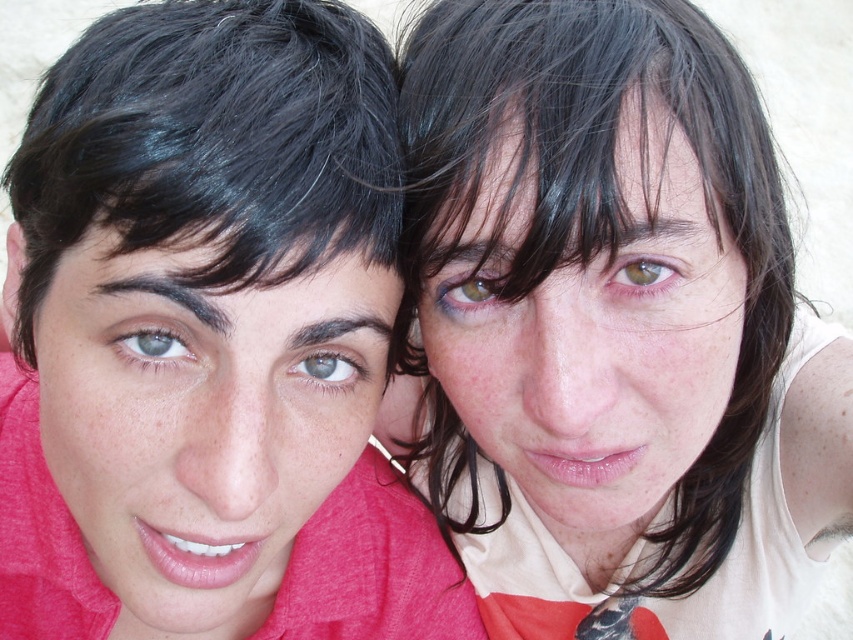
Question: Can you confirm if matte pink shirt at left is bigger than black shiny hair at left?

Choices:
 (A) yes
 (B) no

Answer: (A)

Question: Estimate the real-world distances between objects in this image. Which object is farther from the gray matte eye at center?

Choices:
 (A) dry matte skin at center
 (B) brown matte eye at upper center

Answer: (A)

Question: Where is green matte eye at center located in relation to brown matte eye at upper center in the image?

Choices:
 (A) right
 (B) left

Answer: (B)

Question: Estimate the real-world distances between objects in this image. Which object is closer to the green matte eye at center?

Choices:
 (A) black shiny hair at left
 (B) gray matte eye at center
 (C) brown matte eye at upper center
 (D) green matte eye at upper center

Answer: (B)

Question: Observing the image, what is the correct spatial positioning of matte pink shirt at left in reference to brown matte eye at upper center?

Choices:
 (A) left
 (B) right

Answer: (A)

Question: Among these points, which one is farthest from the camera?

Choices:
 (A) (99, 227)
 (B) (433, 284)
 (C) (293, 211)
 (D) (589, 296)

Answer: (B)